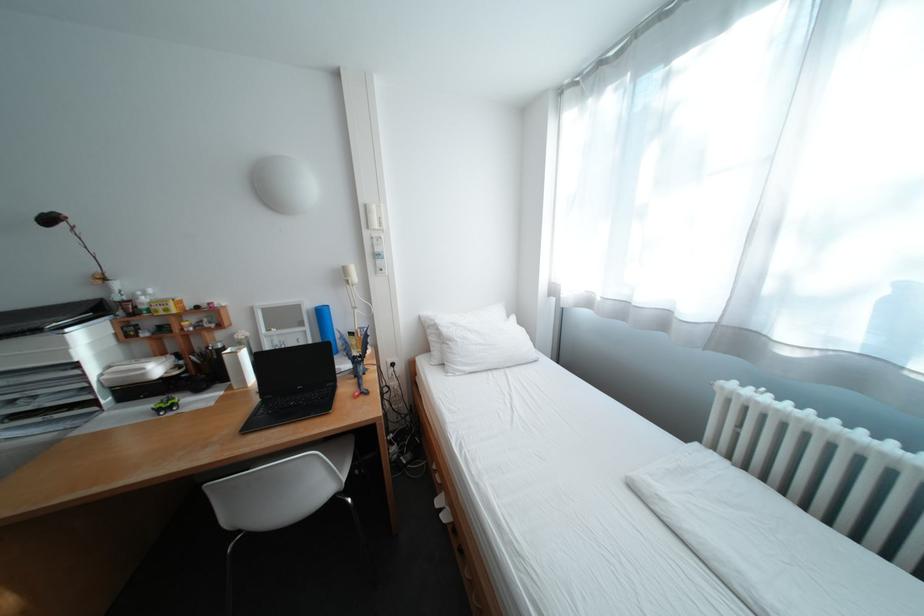
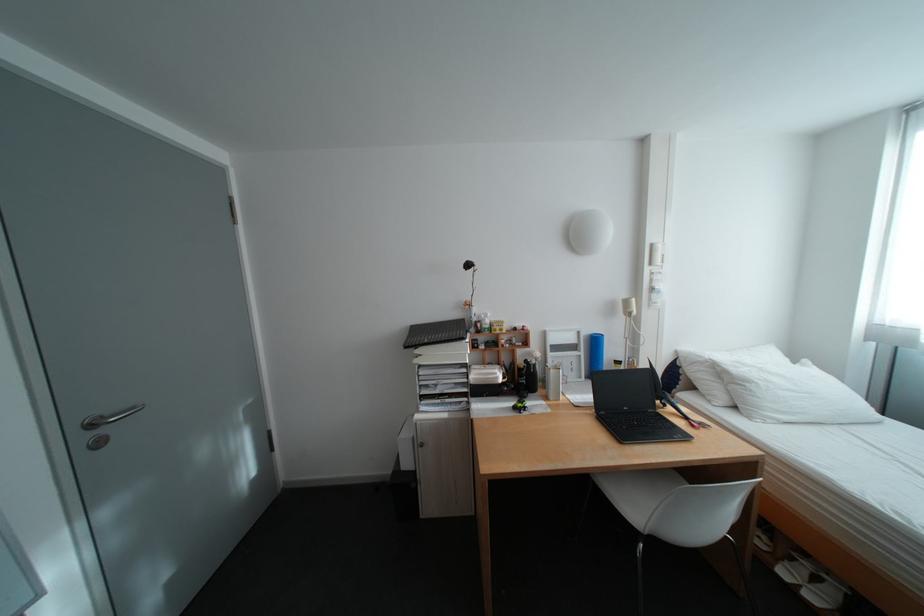
The point at (256,339) is marked in the first image. Where is the corresponding point in the second image?

(552, 358)